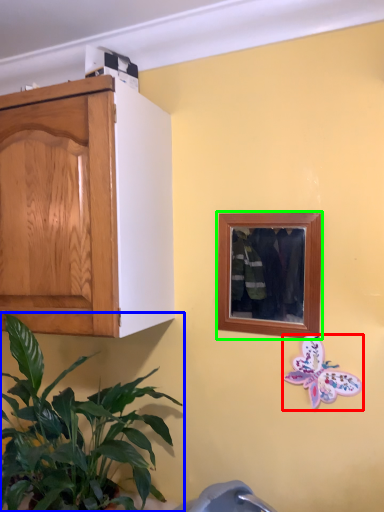
Question: Which object is the closest to the butterfly (highlighted by a red box)? Choose among these: houseplant (highlighted by a blue box) or picture frame (highlighted by a green box).

Choices:
 (A) houseplant
 (B) picture frame

Answer: (B)